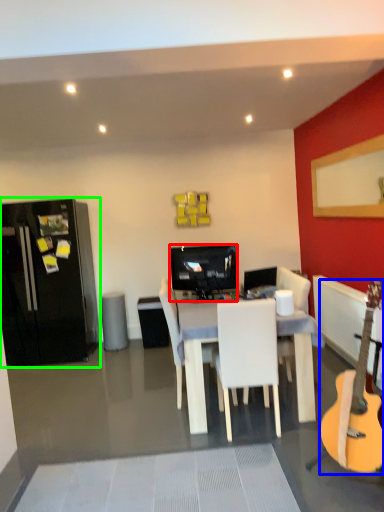
Question: Estimate the real-world distances between objects in this image. Which object is farther from television (highlighted by a red box), guitar (highlighted by a blue box) or refrigerator (highlighted by a green box)?

Choices:
 (A) guitar
 (B) refrigerator

Answer: (A)